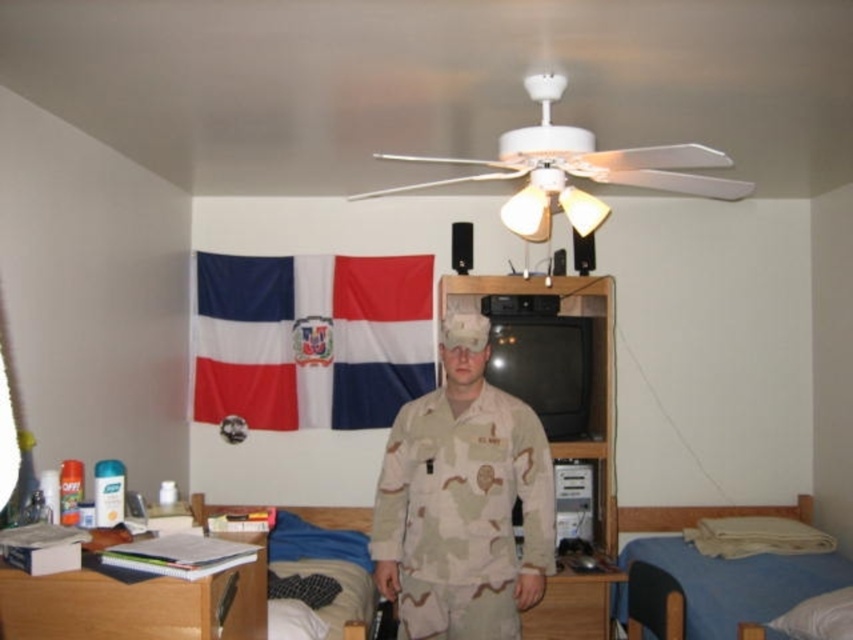
Question: Can you confirm if wooden at left is smaller than wooden drawer at lower center?

Choices:
 (A) no
 (B) yes

Answer: (A)

Question: Can you confirm if camouflage fabric uniform at center is wider than wooden at left?

Choices:
 (A) yes
 (B) no

Answer: (A)

Question: Which point is farther from the camera taking this photo?

Choices:
 (A) (798, 515)
 (B) (97, 605)

Answer: (A)

Question: Does white fabric flag at upper left appear on the left side of blue fabric bed at lower right?

Choices:
 (A) no
 (B) yes

Answer: (B)

Question: Among these objects, which one is nearest to the camera?

Choices:
 (A) blue fabric bed at lower right
 (B) wooden at left
 (C) blue fabric bed at lower left
 (D) camouflage fabric uniform at center

Answer: (B)

Question: Which point is closer to the camera?

Choices:
 (A) (575, 580)
 (B) (338, 525)

Answer: (A)